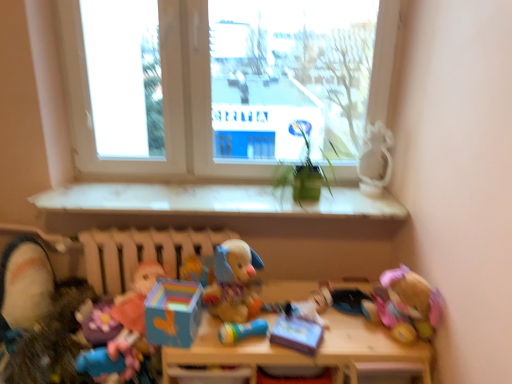
Locate an element on the screen. This screenshot has height=384, width=512. free space below fluffy pink teddy bear at right, which is the ninth toy from left to right (from a real-world perspective) is located at coordinates pyautogui.click(x=386, y=329).